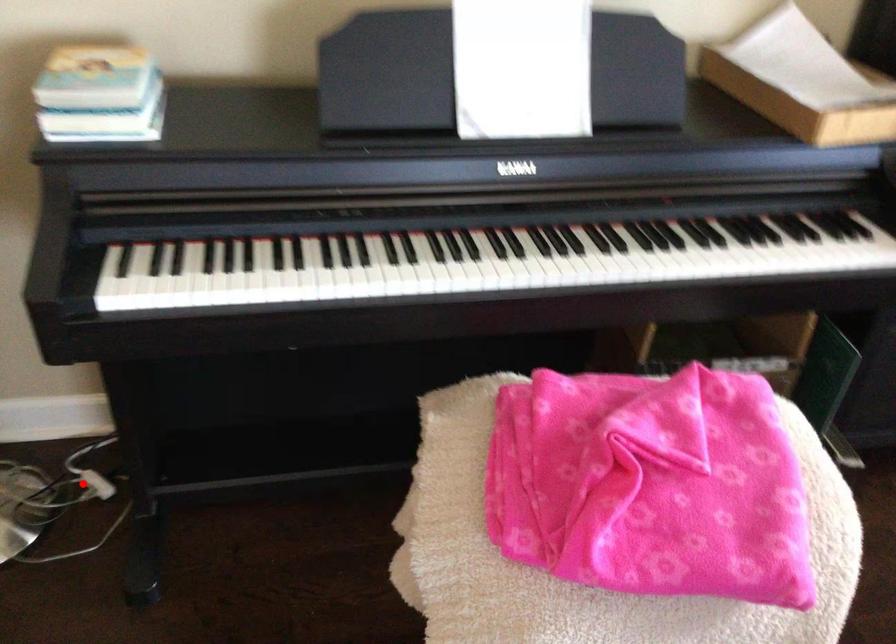
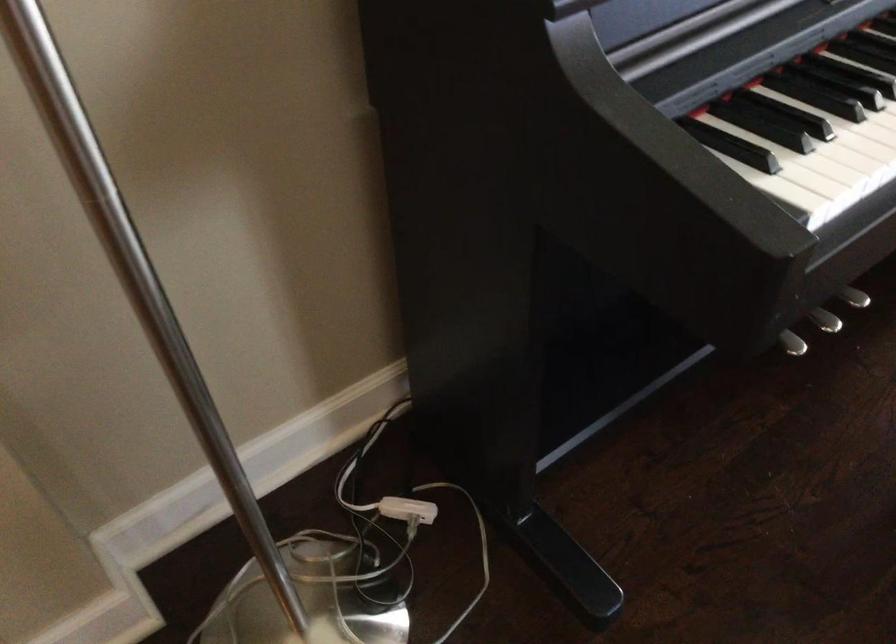
Question: I am providing you with two images of the same scene from different viewpoints. Given a red point in image1, look at the same physical point in image2. Is it:

Choices:
 (A) Closer to the viewpoint
 (B) Farther from the viewpoint

Answer: (A)